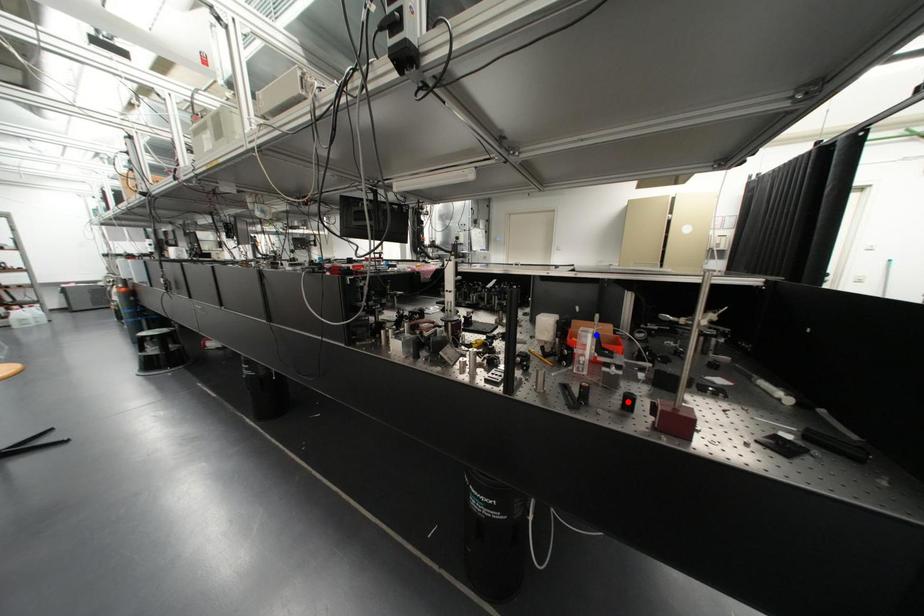
Question: Two points are marked on the image. Which point is closer to the camera?

Choices:
 (A) Blue point is closer.
 (B) Red point is closer.

Answer: (B)